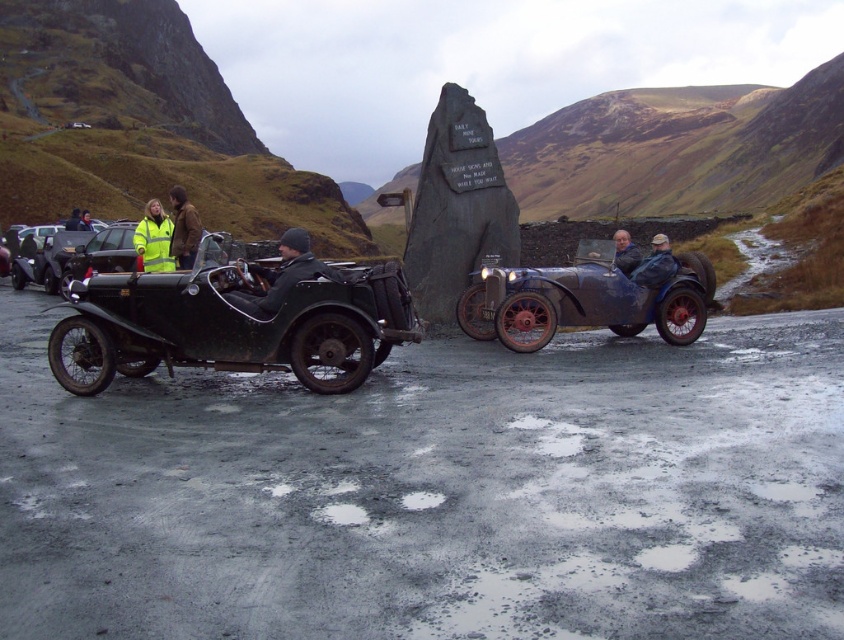
You are a photographer planning to take a photo of the dark green leather jacket at center and the gray fabric jacket at center in the mountainous scene. Which jacket should you focus on first if you want to capture the one that is shorter in height?

The dark green leather jacket at center is shorter in height compared to the gray fabric jacket at center, so you should focus on the dark green leather jacket at center first.

You are a photographer trying to capture both the dark green leather jacket at center and the gray fabric jacket at center in a single shot. Since you want to emphasize the size difference between them, which jacket should you position closer to the camera?

To emphasize the size difference between the dark green leather jacket at center and the gray fabric jacket at center, you should position the dark green leather jacket at center closer to the camera since it is smaller than the gray fabric jacket at center. This way, the smaller jacket will appear larger in the frame compared to the larger jacket placed farther back, creating a visual contrast in their sizes.

You are a photographer planning to take a photo of both the dark gray stone monument at center and the dark green leather jacket at center. Which object should you focus on first if you want to capture both in a single shot without moving the camera?

The dark gray stone monument at center is positioned on the right side of the dark green leather jacket at center, so you should focus on the dark green leather jacket at center first to ensure both are in frame.